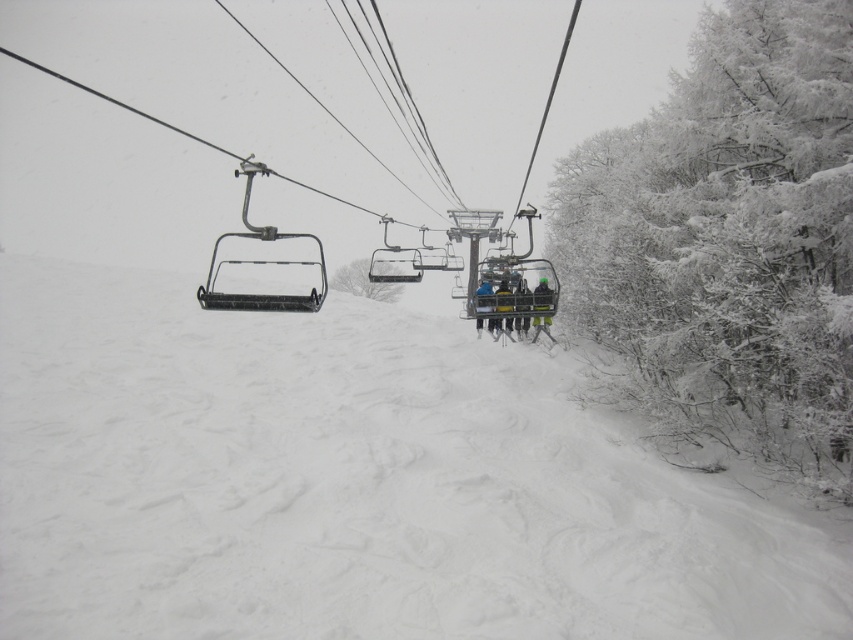
Which is more to the left, snow-covered branches at right or yellow fabric jacket at center?

yellow fabric jacket at center is more to the left.

Can you confirm if snow-covered branches at right is taller than yellow fabric jacket at center?

Yes, snow-covered branches at right is taller than yellow fabric jacket at center.

Which is behind, point (664, 307) or point (498, 308)?

The point (664, 307) is behind.

You are a GUI agent. You are given a task and a screenshot of the screen. Output one action in this format:
    pyautogui.click(x=<x>, y=<y>)
    Task: Click on the snow-covered branches at right
    This screenshot has width=853, height=640.
    Given the screenshot: What is the action you would take?
    pyautogui.click(x=729, y=241)

Is white snow at center above blue fabric jacket at center?

No.

Does white snow at center have a greater width compared to blue fabric jacket at center?

Yes, white snow at center is wider than blue fabric jacket at center.

Does point (109, 320) lie behind point (488, 289)?

Yes, point (109, 320) is farther from viewer.

Locate an element on the screen. white snow at center is located at coordinates (351, 483).

Who is higher up, dark blue fabric jacket at center or yellow fabric jacket at center?

yellow fabric jacket at center

Is dark blue fabric jacket at center behind yellow fabric jacket at center?

No, it is not.

Where is `dark blue fabric jacket at center`? dark blue fabric jacket at center is located at coordinates coord(520,307).

Image resolution: width=853 pixels, height=640 pixels. I want to click on dark blue fabric jacket at center, so click(x=520, y=307).